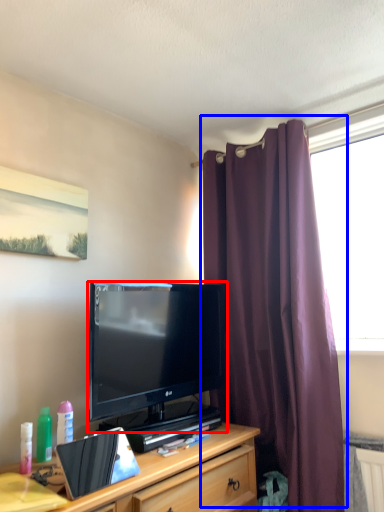
Question: Which object appears farthest to the camera in this image, television (highlighted by a red box) or curtain (highlighted by a blue box)?

Choices:
 (A) television
 (B) curtain

Answer: (B)